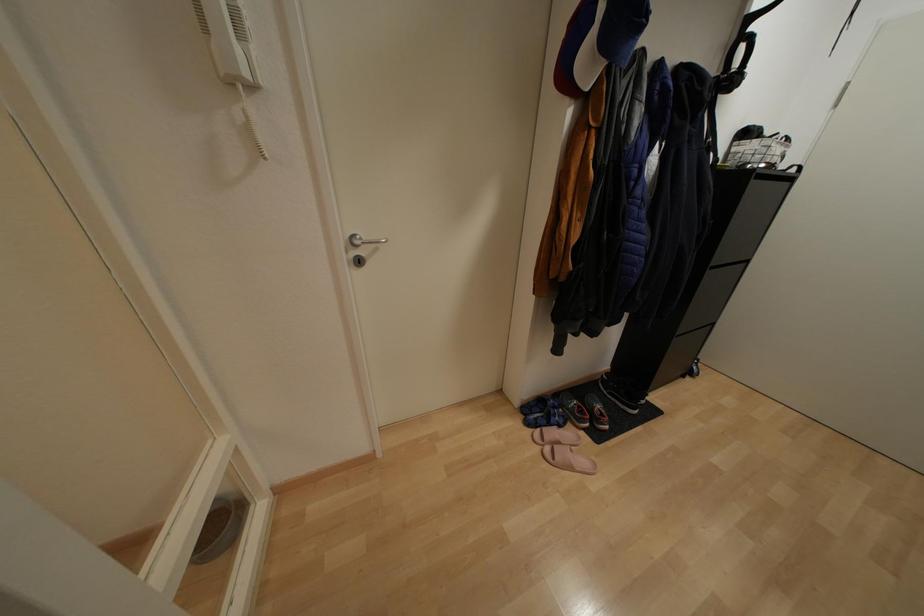
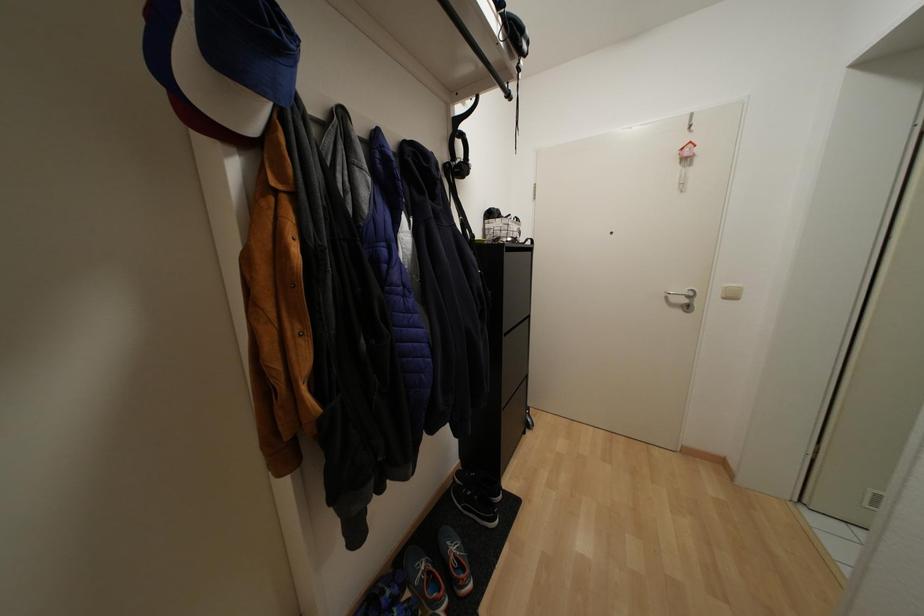
Question: The first image is from the beginning of the video and the second image is from the end. How did the camera likely rotate when shooting the video?

Choices:
 (A) Left
 (B) Right
 (C) Up
 (D) Down

Answer: (B)